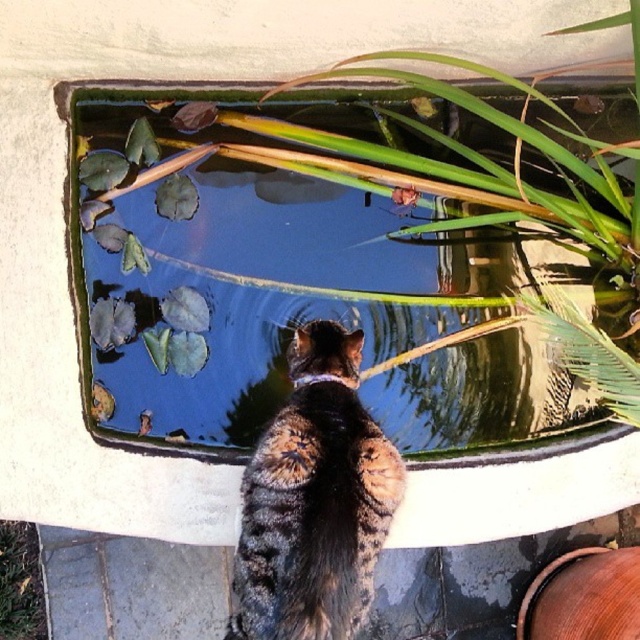
Who is shorter, green leafy plant at upper center or green leafy plant at lower left?

With less height is green leafy plant at lower left.

Is point (272, 371) in front of point (4, 612)?

Yes, point (272, 371) is closer to viewer.

Locate an element on the screen. green leafy plant at upper center is located at coordinates (356, 248).

Is point (182, 324) less distant than point (237, 605)?

No, (182, 324) is behind (237, 605).

Consider the image. Between green leafy plant at upper center and tabby fur cat at center, which one has more height?

green leafy plant at upper center is taller.

Is point (451, 225) farther from viewer compared to point (333, 563)?

Yes, point (451, 225) is behind point (333, 563).

Where is `green leafy plant at upper center`? Image resolution: width=640 pixels, height=640 pixels. green leafy plant at upper center is located at coordinates (356, 248).

This screenshot has height=640, width=640. What do you see at coordinates (314, 500) in the screenshot?
I see `tabby fur cat at center` at bounding box center [314, 500].

Which is in front, point (358, 465) or point (42, 608)?

Point (358, 465) is more forward.

Find the location of a particular element. The height and width of the screenshot is (640, 640). tabby fur cat at center is located at coordinates (314, 500).